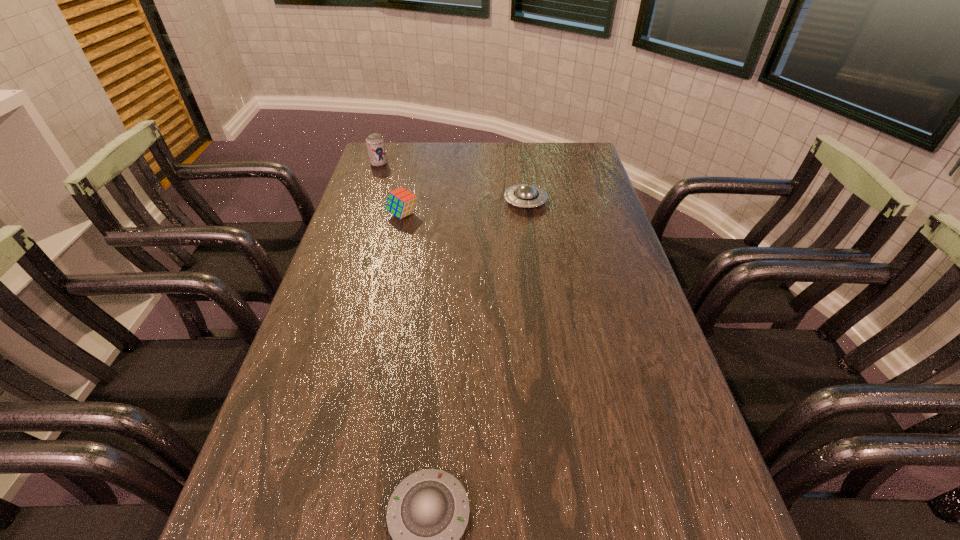
Identify the location of beer can present at the left edge. The image size is (960, 540). (375, 144).

Find the location of a particular element. This screenshot has width=960, height=540. cube that is positioned at the left edge is located at coordinates (400, 202).

This screenshot has height=540, width=960. I want to click on object located in the far left corner section of the desktop, so click(x=375, y=144).

At what (x,y) coordinates should I click in order to perform the action: click on free space at the far edge of the desktop. Please return your answer as a coordinate pair (x, y). Looking at the image, I should click on (532, 158).

The width and height of the screenshot is (960, 540). In the image, there is a desktop. In order to click on vacant region at the left edge in this screenshot , I will do `click(225, 526)`.

Identify the location of vacant space at the right edge. (605, 201).

I want to click on vacant space at the far right corner of the desktop, so click(x=574, y=172).

The image size is (960, 540). In order to click on free spot between the leftmost object and the second object from left to right in this screenshot , I will do `click(391, 190)`.

Find the location of a particular element. This screenshot has width=960, height=540. free area in between the second object from left to right and the tallest object is located at coordinates (391, 190).

At what (x,y) coordinates should I click in order to perform the action: click on unoccupied position between the second object from left to right and the leftmost object. Please return your answer as a coordinate pair (x, y). The width and height of the screenshot is (960, 540). Looking at the image, I should click on (391, 190).